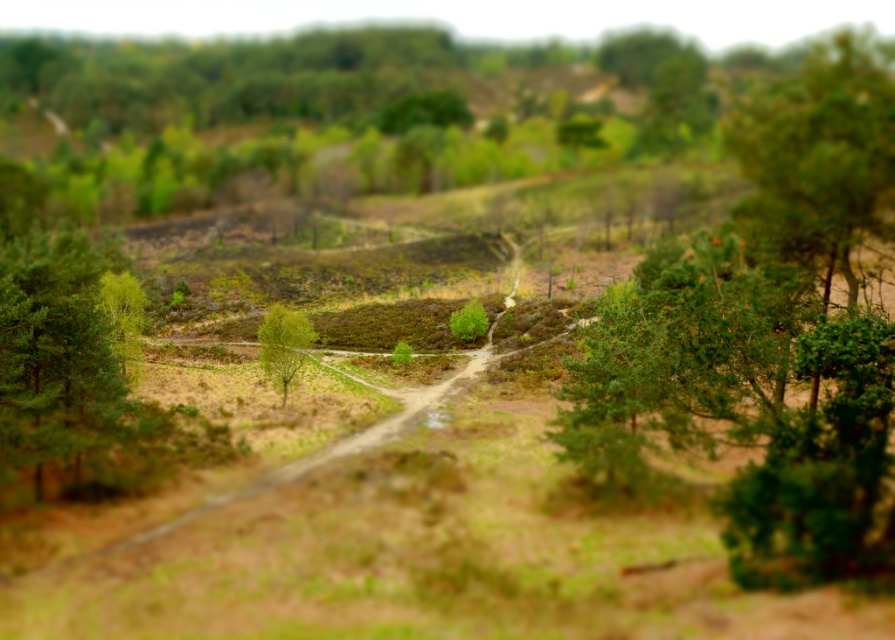
Does green matte tree at right appear under green leafy tree at center?

No, green matte tree at right is not below green leafy tree at center.

Where is `green matte tree at right`? green matte tree at right is located at coordinates (770, 333).

Between point (872, 216) and point (283, 352), which one is positioned behind?

Point (283, 352)

At what (x,y) coordinates should I click in order to perform the action: click on green matte tree at right. Please return your answer as a coordinate pair (x, y). The height and width of the screenshot is (640, 895). Looking at the image, I should click on (770, 333).